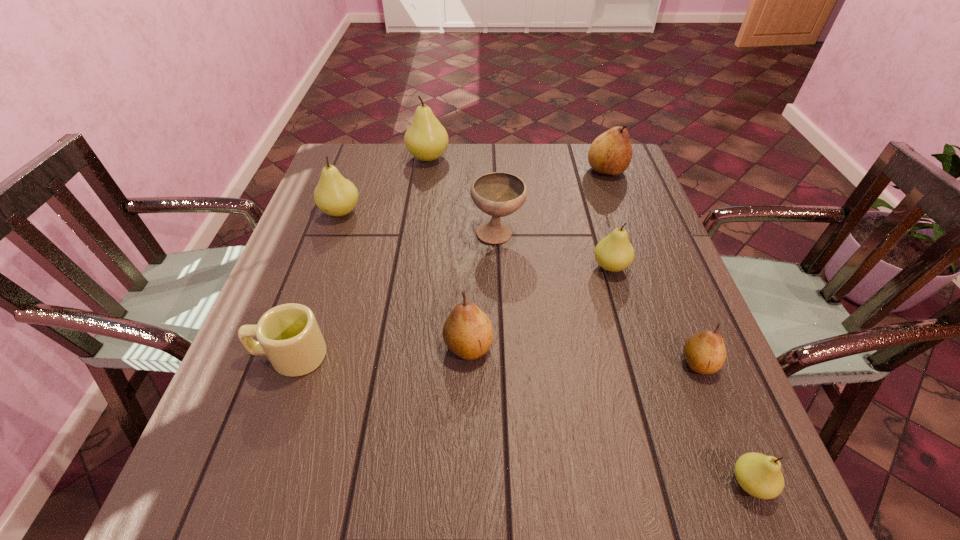
Identify the location of the seventh object from right to left. (426, 139).

What are the coordinates of `the biggest green pear` in the screenshot? It's located at (426, 139).

Locate an element on the screen. This screenshot has width=960, height=540. the biggest brown pear is located at coordinates (611, 152).

Where is `the leftmost green pear`? This screenshot has width=960, height=540. the leftmost green pear is located at coordinates pyautogui.click(x=336, y=196).

Locate an element on the screen. This screenshot has width=960, height=540. the third farthest pear is located at coordinates (336, 196).

This screenshot has height=540, width=960. I want to click on chalice, so click(x=498, y=194).

You are a GUI agent. You are given a task and a screenshot of the screen. Output one action in this format:
    pyautogui.click(x=<x>, y=<y>)
    Task: Click on the third pear from left to right
    
    Given the screenshot: What is the action you would take?
    pyautogui.click(x=467, y=332)

You are a GUI agent. You are given a task and a screenshot of the screen. Output one action in this format:
    pyautogui.click(x=<x>, y=<y>)
    Task: Click on the leftmost brown pear
    
    Given the screenshot: What is the action you would take?
    pyautogui.click(x=467, y=332)

The image size is (960, 540). What are the coordinates of `the fifth farthest object` in the screenshot? It's located at point(614,253).

Image resolution: width=960 pixels, height=540 pixels. I want to click on the fourth nearest pear, so click(x=614, y=253).